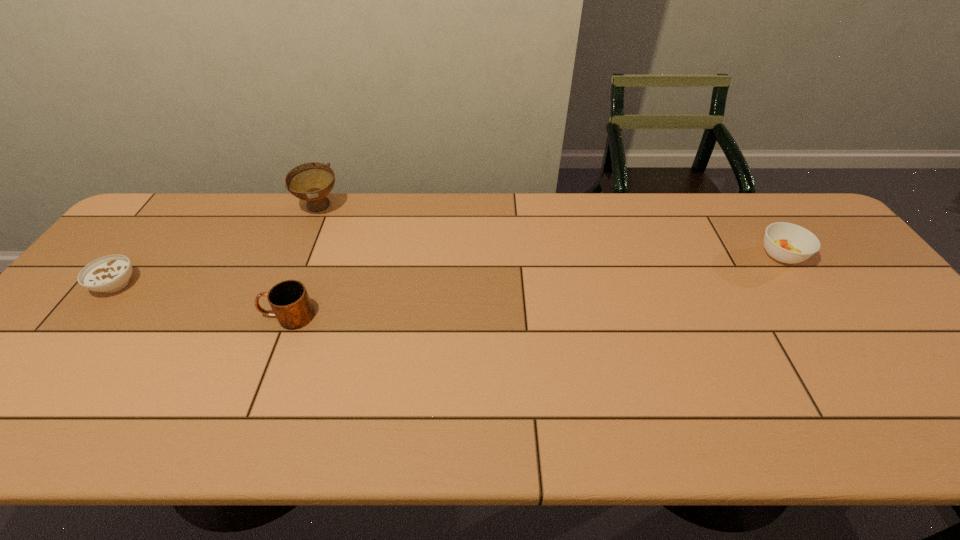
The width and height of the screenshot is (960, 540). Find the location of `the farthest object`. the farthest object is located at coordinates (312, 182).

Find the location of a particular element. the second soup bowl from left to right is located at coordinates (312, 182).

Identify the location of the third shortest object. The image size is (960, 540). (289, 300).

This screenshot has width=960, height=540. In order to click on mug in this screenshot , I will do `click(289, 300)`.

Where is `the rightmost soup bowl`? The height and width of the screenshot is (540, 960). the rightmost soup bowl is located at coordinates (785, 242).

What are the coordinates of `the rightmost object` in the screenshot? It's located at (785, 242).

The image size is (960, 540). Find the location of `the shortest object`. the shortest object is located at coordinates (111, 273).

I want to click on the shortest soup bowl, so click(x=111, y=273).

Locate an element on the screen. The height and width of the screenshot is (540, 960). free spot located 0.090m on the left of the tallest object is located at coordinates (268, 207).

You are a GUI agent. You are given a task and a screenshot of the screen. Output one action in this format:
    pyautogui.click(x=<x>, y=<y>)
    Task: Click on the blank space located on the side of the second tallest object with the handle
    The image size is (960, 540).
    Given the screenshot: What is the action you would take?
    pyautogui.click(x=237, y=316)